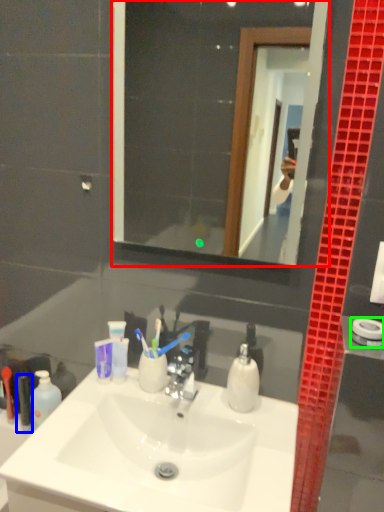
Question: Which is farther away from mirror (highlighted by a red box)? toiletry (highlighted by a blue box) or towel bar (highlighted by a green box)?

Choices:
 (A) toiletry
 (B) towel bar

Answer: (B)